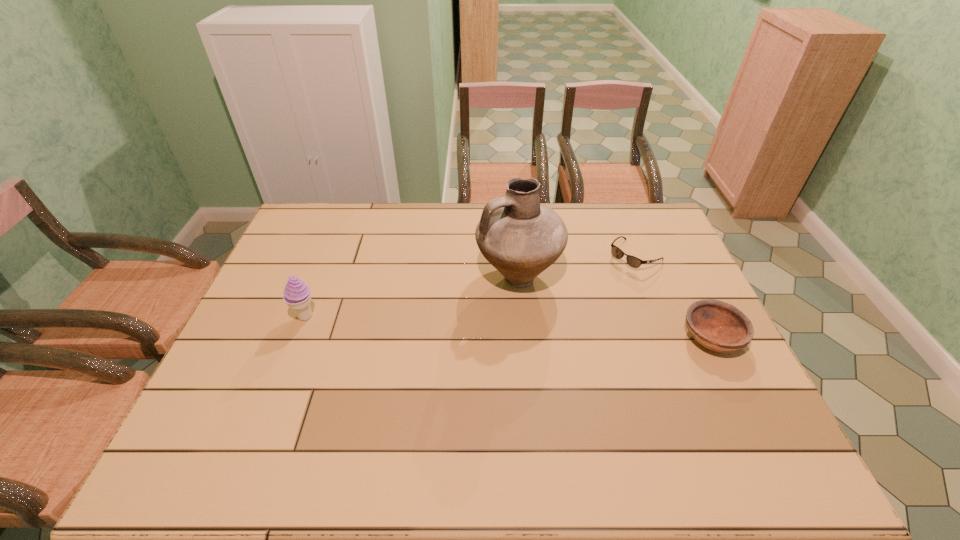
This screenshot has width=960, height=540. Find the location of `icecream`. icecream is located at coordinates [x=297, y=295].

Locate an element on the screen. The image size is (960, 540). the leftmost object is located at coordinates (297, 295).

You are a GUI agent. You are given a task and a screenshot of the screen. Output one action in this format:
    pyautogui.click(x=<x>, y=<y>)
    Task: Click on the second shortest object
    The width and height of the screenshot is (960, 540).
    Given the screenshot: What is the action you would take?
    pyautogui.click(x=721, y=327)

This screenshot has height=540, width=960. Identify the location of the shortest object. (632, 261).

Where is `the tallest object`? the tallest object is located at coordinates (519, 236).

Find the location of a particular element. pitcher is located at coordinates (519, 236).

This screenshot has width=960, height=540. What are the coordinates of `blank space located 0.100m on the left of the icecream` in the screenshot? It's located at (258, 316).

Where is `vacant area located 0.140m on the left of the third tallest object`? The image size is (960, 540). vacant area located 0.140m on the left of the third tallest object is located at coordinates (631, 338).

Identify the location of free spot located 0.150m on the front-facing side of the sunglasses. The height and width of the screenshot is (540, 960). (592, 291).

You are a GUI agent. You are given a task and a screenshot of the screen. Output one action in this format:
    pyautogui.click(x=<x>, y=<y>)
    Task: Click on the vacant space located 0.360m on the front-facing side of the sunglasses
    The image size is (960, 540).
    Given the screenshot: What is the action you would take?
    pyautogui.click(x=547, y=326)